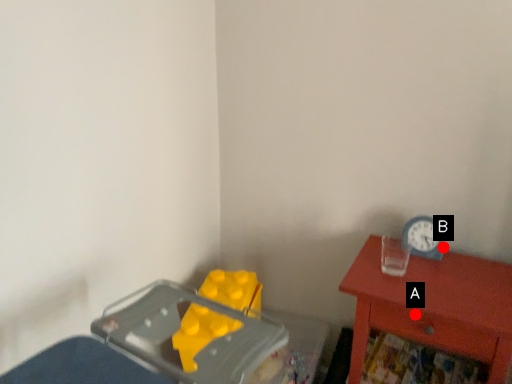
Question: Two points are circled on the image, labeled by A and B beside each circle. Which point is farther to the camera?

Choices:
 (A) A is further
 (B) B is further

Answer: (B)